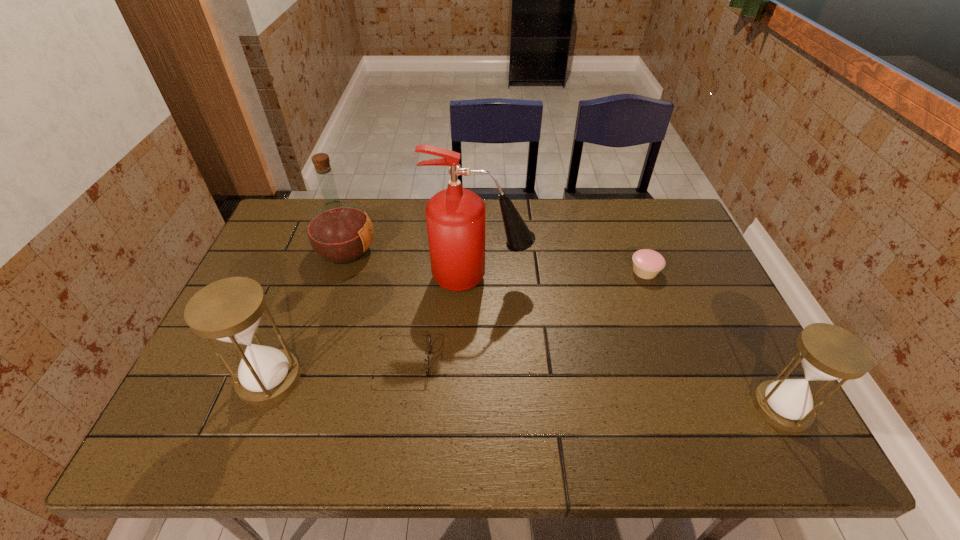
Find the location of a particular element. This screenshot has width=960, height=540. the taller hourglass is located at coordinates (229, 310).

Image resolution: width=960 pixels, height=540 pixels. I want to click on the third tallest object, so click(x=229, y=310).

Locate an element on the screen. the rightmost object is located at coordinates (828, 352).

Find the location of a particular element. This screenshot has width=960, height=540. the fourth tallest object is located at coordinates (828, 352).

Image resolution: width=960 pixels, height=540 pixels. Find the location of `the fifth object from left to right`. the fifth object from left to right is located at coordinates (647, 263).

Identify the location of the fifth tallest object. (647, 263).

Where is `liquor`? This screenshot has height=540, width=960. liquor is located at coordinates (339, 232).

The width and height of the screenshot is (960, 540). What are the coordinates of `the shortest object` in the screenshot? It's located at (429, 349).

This screenshot has width=960, height=540. I want to click on fire extinguisher, so click(x=455, y=217).

The height and width of the screenshot is (540, 960). I want to click on free space located 0.360m on the back of the taller hourglass, so click(317, 256).